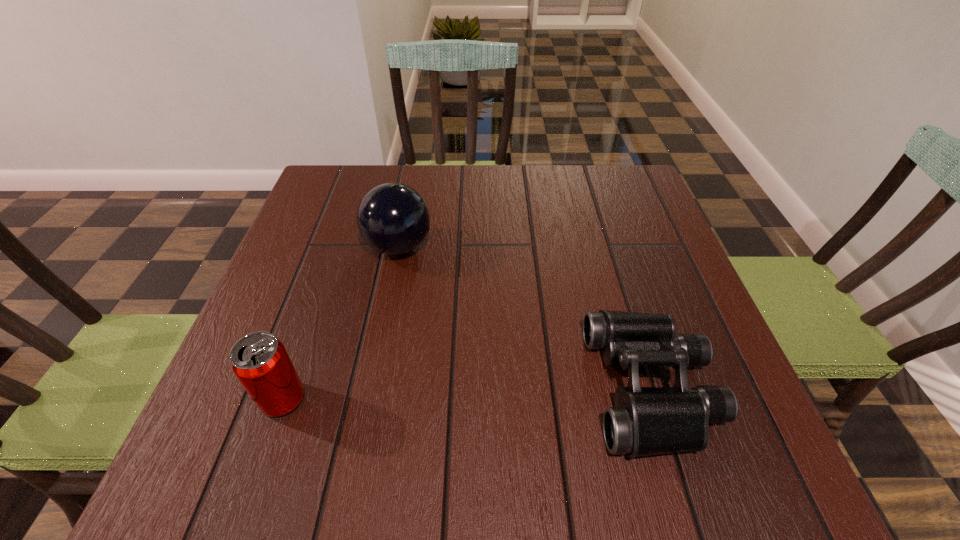
At what (x,y) coordinates should I click in order to perform the action: click on object at the near edge. Please return your answer as a coordinate pair (x, y). This screenshot has width=960, height=540. Looking at the image, I should click on (645, 421).

This screenshot has width=960, height=540. I want to click on object positioned at the left edge, so click(x=259, y=360).

This screenshot has height=540, width=960. I want to click on object located in the right edge section of the desktop, so click(645, 421).

Locate an element on the screen. The width and height of the screenshot is (960, 540). object that is at the near right corner is located at coordinates coord(645,421).

Find the location of `free space at the far edge of the desktop`. free space at the far edge of the desktop is located at coordinates click(442, 207).

Image resolution: width=960 pixels, height=540 pixels. Find the location of `free space at the near edge of the desktop`. free space at the near edge of the desktop is located at coordinates (339, 472).

Identify the location of free space at the left edge. Image resolution: width=960 pixels, height=540 pixels. (347, 238).

What are the coordinates of `vacant space at the right edge` in the screenshot? It's located at (652, 219).

The image size is (960, 540). In order to click on vacant space at the far left corner of the desktop in this screenshot , I will do `click(378, 165)`.

In the image, there is a desktop. Identify the location of vacant space at the near left corner. (297, 442).